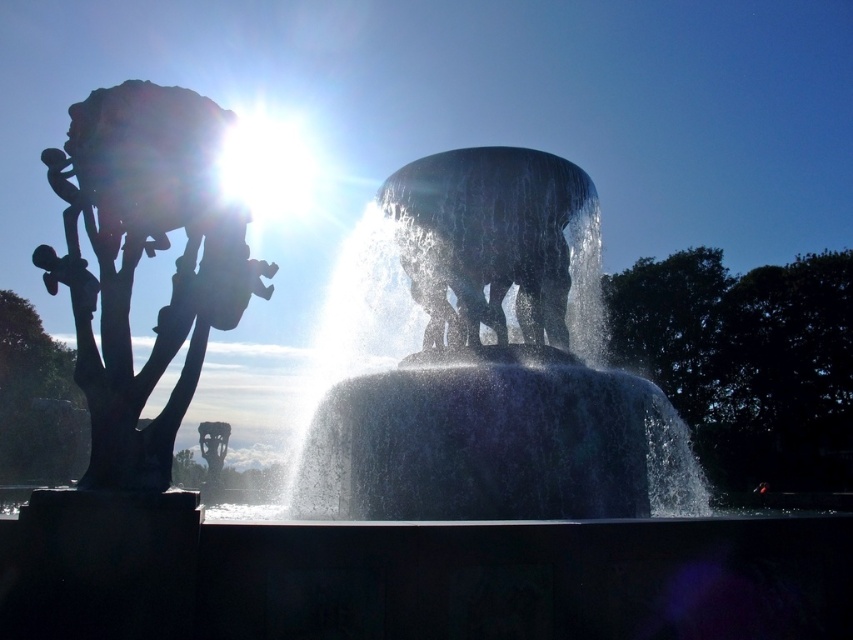
Who is shorter, black matte tree at left or glossy stone elephant at center?

Standing shorter between the two is black matte tree at left.

The width and height of the screenshot is (853, 640). What are the coordinates of `black matte tree at left` in the screenshot? It's located at (149, 256).

Find the location of `black matte tree at left`. black matte tree at left is located at coordinates (149, 256).

Is green leafy tree at center to the right of matte gray tree at left from the viewer's perspective?

Yes, green leafy tree at center is to the right of matte gray tree at left.

Who is lower down, green leafy tree at center or matte gray tree at left?

matte gray tree at left

This screenshot has width=853, height=640. I want to click on green leafy tree at center, so click(x=746, y=360).

This screenshot has width=853, height=640. Identify the location of green leafy tree at center. (746, 360).

Is translucent glass water at center smaller than matte gray tree at left?

Incorrect, translucent glass water at center is not smaller in size than matte gray tree at left.

Is translucent glass water at center above matte gray tree at left?

Correct, translucent glass water at center is located above matte gray tree at left.

The image size is (853, 640). Identify the location of translucent glass water at center. (496, 368).